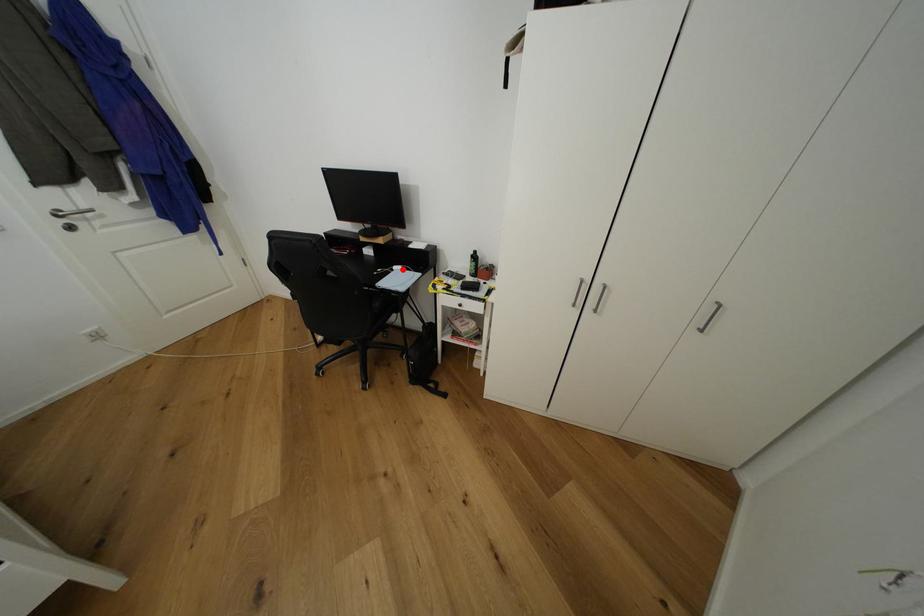
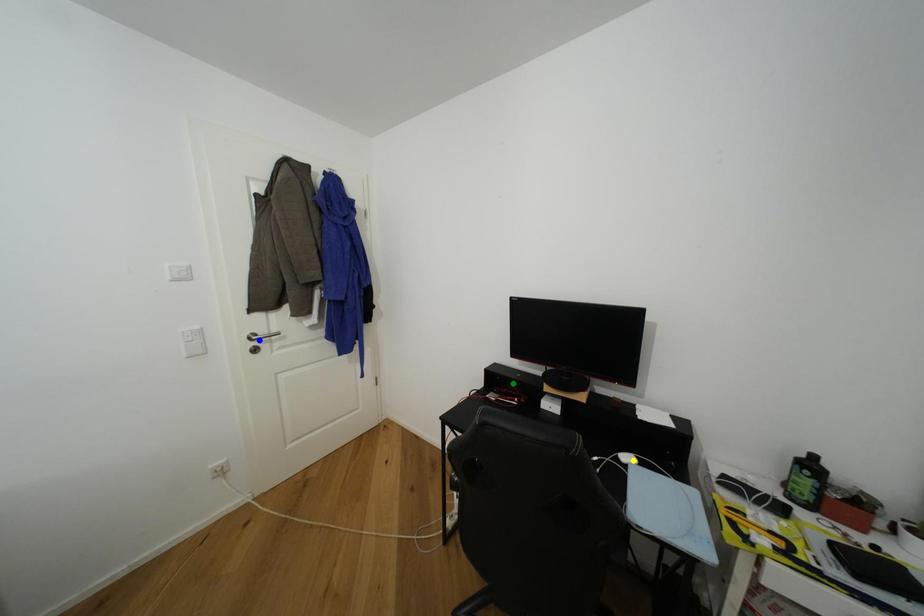
Question: I am providing you with two images of the same scene from different viewpoints. A red point is marked on the first image. You are given multiple points on the second image. Which spot in image 2 lines up with the point in image 1?

Choices:
 (A) blue point
 (B) green point
 (C) yellow point

Answer: (C)